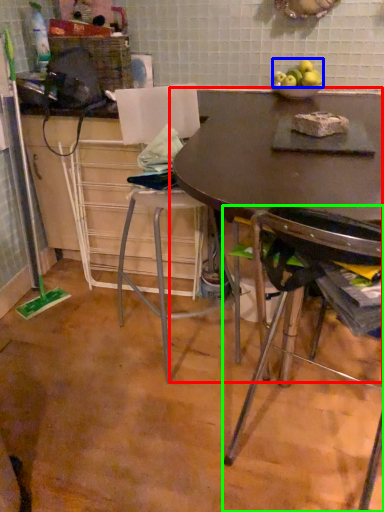
Question: Which object is the farthest from table (highlighted by a red box)? Choose among these: apple (highlighted by a blue box) or chair (highlighted by a green box).

Choices:
 (A) apple
 (B) chair

Answer: (B)